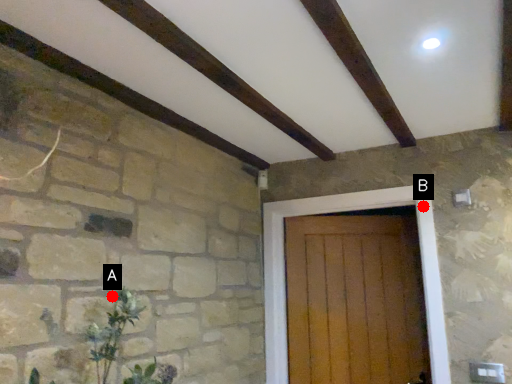
Question: Two points are circled on the image, labeled by A and B beside each circle. Among these points, which one is nearest to the camera?

Choices:
 (A) A is closer
 (B) B is closer

Answer: (A)